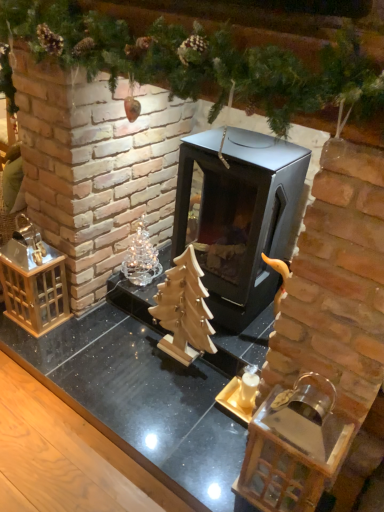
The height and width of the screenshot is (512, 384). I want to click on space that is in front of wooden christmas tree at center, so click(x=165, y=392).